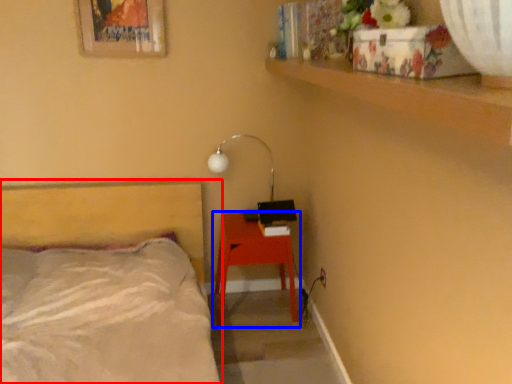
Question: Which of the following is the farthest to the observer, bed (highlighted by a red box) or nightstand (highlighted by a blue box)?

Choices:
 (A) bed
 (B) nightstand

Answer: (B)